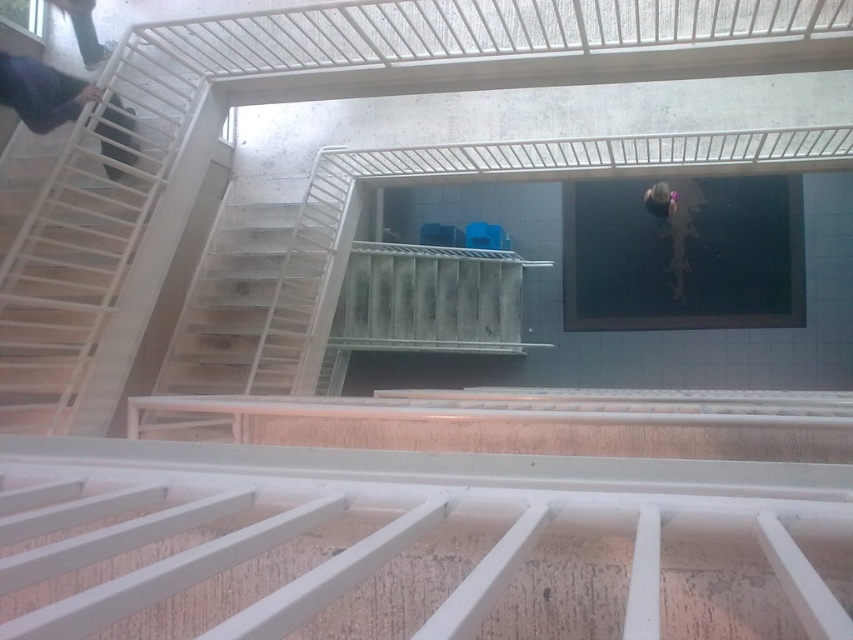
Between dark blue fabric at upper left and smooth purple helmet at upper center, which one appears on the left side from the viewer's perspective?

From the viewer's perspective, dark blue fabric at upper left appears more on the left side.

Between dark blue fabric at upper left and smooth purple helmet at upper center, which one has more height?

With more height is dark blue fabric at upper left.

Who is more forward, (15, 90) or (659, 198)?

Point (15, 90) is in front.

The height and width of the screenshot is (640, 853). Find the location of `dark blue fabric at upper left`. dark blue fabric at upper left is located at coordinates (41, 92).